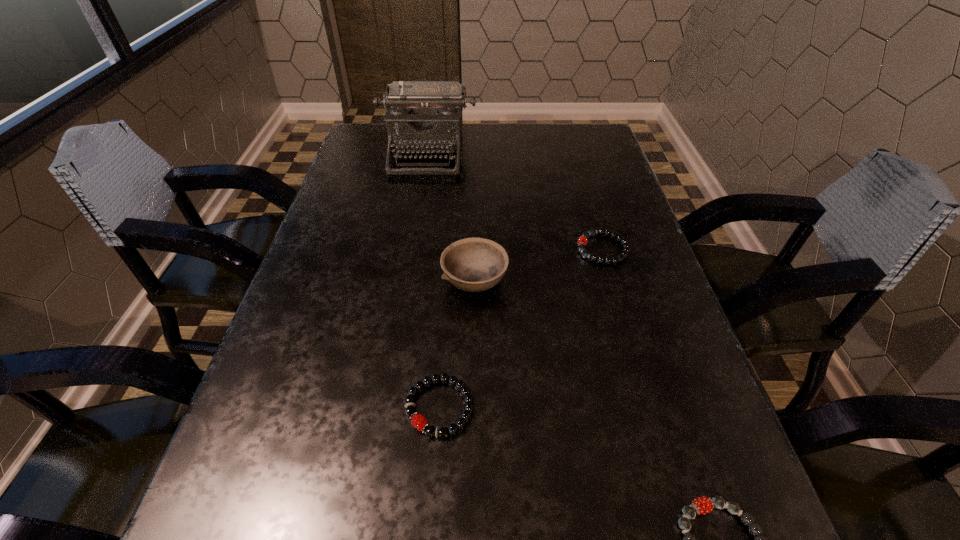
In order to click on vacant point that satisfies the following two spatial constraints: 1. on the typing side of the farthest bracelet; 2. on the right side of the farthest object in this screenshot , I will do `click(412, 249)`.

I want to click on blank area in the image that satisfies the following two spatial constraints: 1. on the typing side of the tallest object; 2. on the left side of the second farthest bracelet, so click(385, 407).